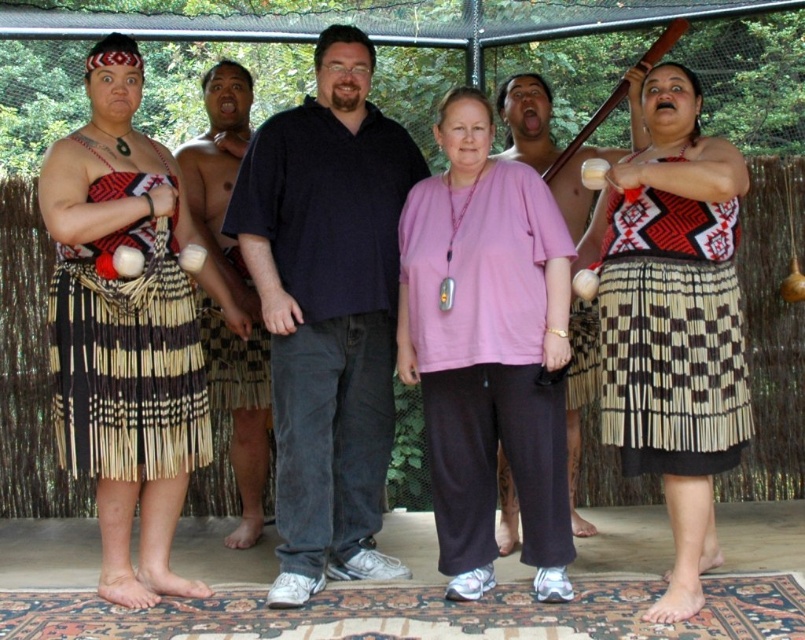
You are standing in front of the group of six individuals under the canopy. You notice two points marked in the scene. Which point, point 1 at coordinates [263,472] or point 2 at [581,326], is closer to you?

Point 1 at coordinates [263,472] is closer to you because it is further to the viewer than point 2 at [581,326].

You are a photographer positioned to the front of the group. You want to capture a photo that includes both the natural woven skirt at left and the matte black shirt at center. Based on their positions, which object should you ensure is closer to the camera to include both in the frame?

The natural woven skirt at left is in front of the matte black shirt at center, so to include both in the frame, ensure the natural woven skirt at left is closer to the camera.

You are organizing a cultural event and need to ensure that the natural woven skirt at left and the matte black shirt at center can be displayed side by side in a showcase. Given their sizes, will the skirt require more space horizontally than the shirt?

The natural woven skirt at left is wider than the matte black shirt at center, so it will require more horizontal space in the showcase.